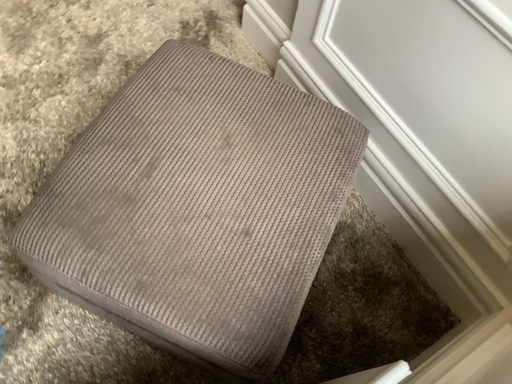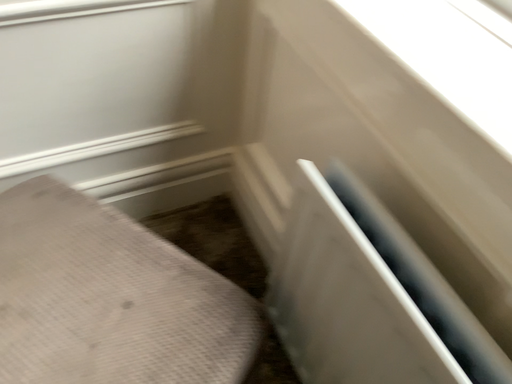
Question: Which way did the camera rotate in the video?

Choices:
 (A) rotated right
 (B) rotated left

Answer: (A)